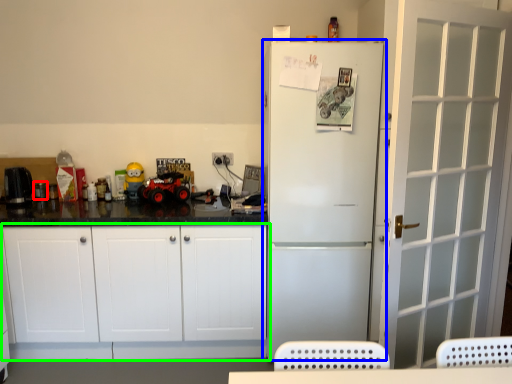
Question: Which object is positioned closest to appliance (highlighted by a red box)? Select from refrigerator (highlighted by a blue box) and cabinetry (highlighted by a green box).

Choices:
 (A) refrigerator
 (B) cabinetry

Answer: (B)